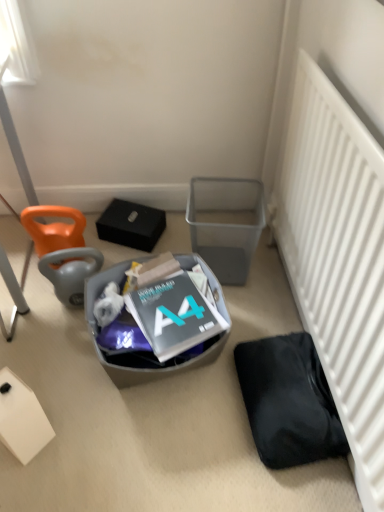
Question: Choose the correct answer: Is orange fabric bean bag chair at left, which ranks as the second bean bag chair in top-to-bottom order, inside metallic gray trash bin at center right, the 2th trash bin/can in the left-to-right sequence, or outside it?

Choices:
 (A) inside
 (B) outside

Answer: (B)

Question: From the image's perspective, is orange fabric bean bag chair at left, which ranks as the second bean bag chair in top-to-bottom order, positioned above or below metallic gray trash bin at center right, the 2th trash bin/can in the left-to-right sequence?

Choices:
 (A) above
 (B) below

Answer: (B)

Question: Which is nearer to the orange fabric bean bag chair at left, which ranks as the second bean bag chair in bottom-to-top order?

Choices:
 (A) orange fabric bean bag chair at left, positioned as the first bean bag chair in bottom-to-top order
 (B) black matte bag at lower right
 (C) white matte radiator at lower right
 (D) metallic gray trash bin at center right, the 2th trash bin/can in the left-to-right sequence
 (E) white matte box at lower left

Answer: (A)

Question: Estimate the real-world distances between objects in this image. Which object is farther from the orange fabric bean bag chair at left, which ranks as the second bean bag chair in bottom-to-top order?

Choices:
 (A) translucent plastic trash bin at center, positioned as the second trash bin/can in right-to-left order
 (B) black matte bag at lower right
 (C) white matte radiator at lower right
 (D) metallic gray trash bin at center right, the 2th trash bin/can in the left-to-right sequence
 (E) orange fabric bean bag chair at left, positioned as the first bean bag chair in bottom-to-top order

Answer: (C)